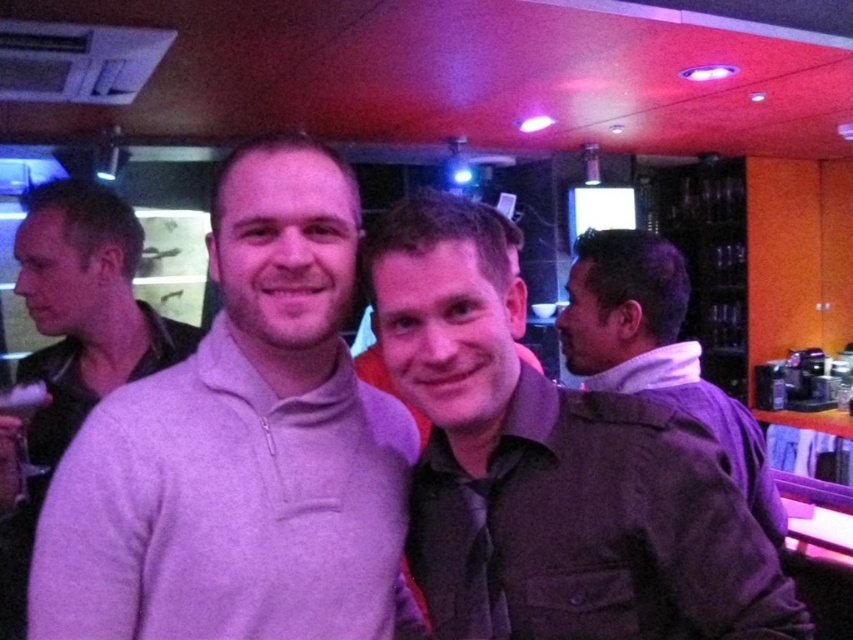
Question: Estimate the real-world distances between objects in this image. Which object is closer to the dark brown jacket at right?

Choices:
 (A) gray fleece sweater at center
 (B) light purple sweater at center
 (C) matte gray shirt at center

Answer: (C)

Question: Which point is closer to the camera taking this photo?

Choices:
 (A) (192, 483)
 (B) (515, 387)

Answer: (A)

Question: Does gray fleece sweater at center appear over matte gray shirt at center?

Choices:
 (A) yes
 (B) no

Answer: (A)

Question: Among these objects, which one is nearest to the camera?

Choices:
 (A) matte gray shirt at center
 (B) light purple sweater at center
 (C) dark brown jacket at right
 (D) gray fleece sweater at center

Answer: (A)

Question: Does matte gray shirt at center come in front of dark brown jacket at right?

Choices:
 (A) no
 (B) yes

Answer: (B)

Question: Does light purple sweater at center have a smaller size compared to dark brown jacket at right?

Choices:
 (A) no
 (B) yes

Answer: (B)